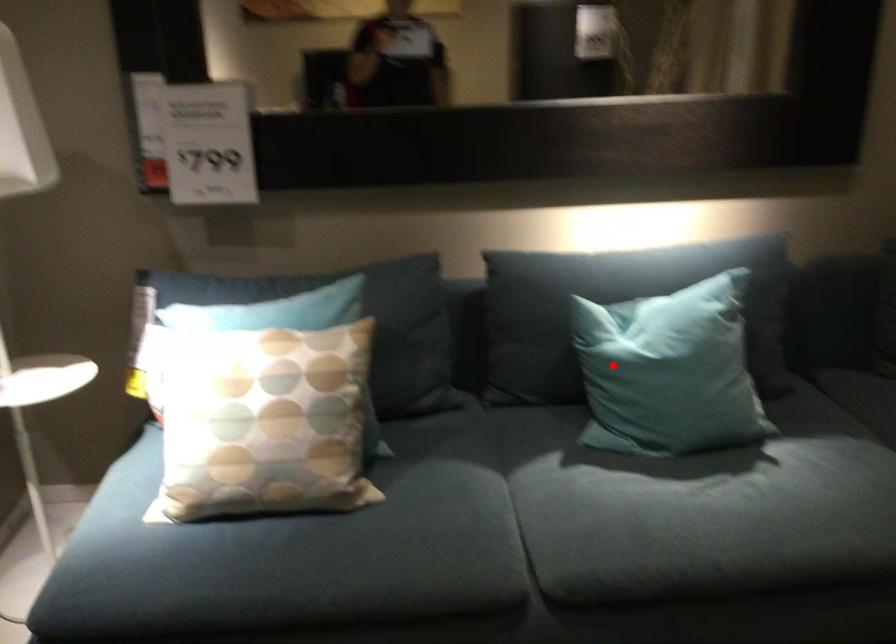
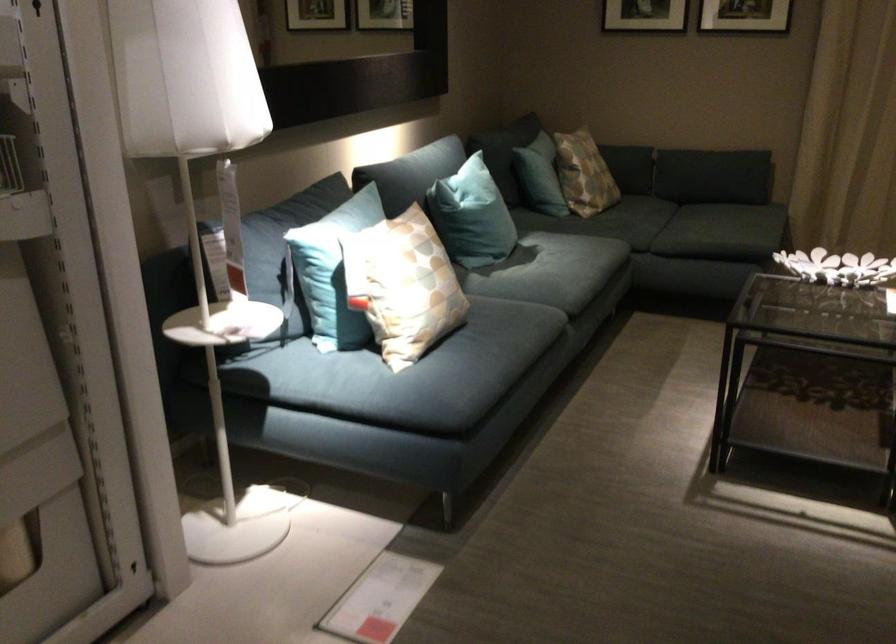
Question: I am providing you with two images of the same scene from different viewpoints. Image1 has a red point marked. In image2, the corresponding 3D location appears at what relative position? Reply with the corresponding letter.

Choices:
 (A) Closer
 (B) Farther

Answer: (B)